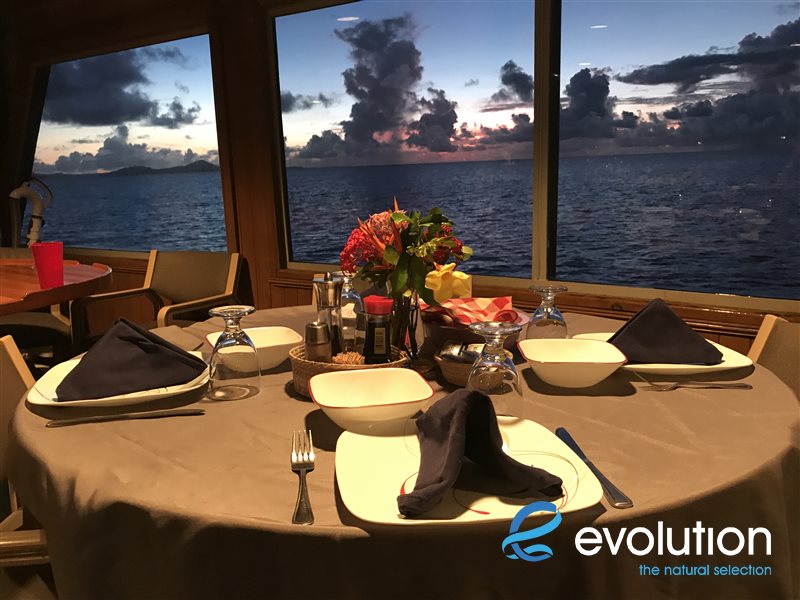
I want to click on glass, so click(x=494, y=359), click(x=544, y=303), click(x=346, y=297), click(x=224, y=338).